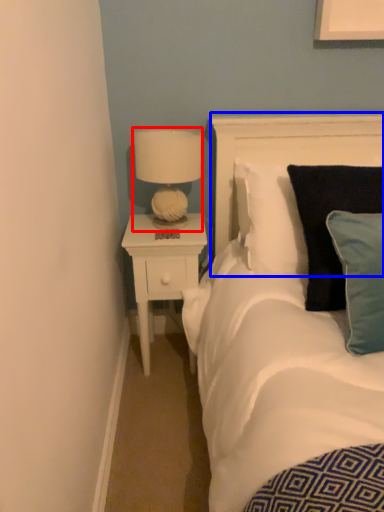
Question: Which object is closer to the camera taking this photo, lamp (highlighted by a red box) or headboard (highlighted by a blue box)?

Choices:
 (A) lamp
 (B) headboard

Answer: (B)